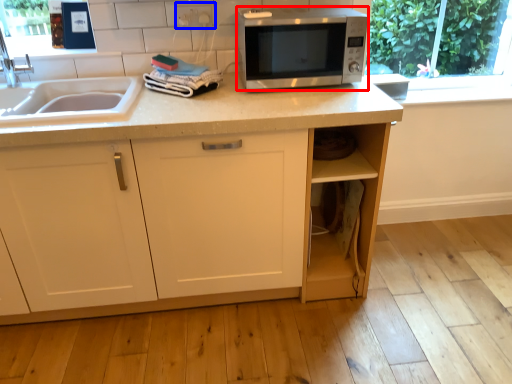
Question: Which object appears closest to the camera in this image, microwave oven (highlighted by a red box) or electric outlet (highlighted by a blue box)?

Choices:
 (A) microwave oven
 (B) electric outlet

Answer: (A)